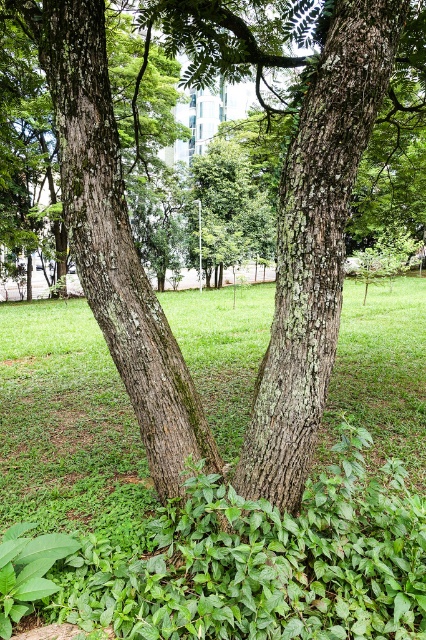
Between green leafy grass at center and smooth bark tree trunk at center, which one is positioned higher?

smooth bark tree trunk at center is higher up.

Is point (348, 616) positioned in front of point (299, 292)?

Yes.

Where is `green leafy grass at center`? Image resolution: width=426 pixels, height=640 pixels. green leafy grass at center is located at coordinates (262, 563).

Does green leafy grass at center have a lesser height compared to green rough bark tree trunk at left?

Indeed, green leafy grass at center has a lesser height compared to green rough bark tree trunk at left.

The image size is (426, 640). Find the location of `green leafy grass at center`. green leafy grass at center is located at coordinates (262, 563).

Between point (51, 362) and point (195, 451), which one is positioned in front?

Point (195, 451)

This screenshot has width=426, height=640. In order to click on green leafy grass at center in this screenshot , I will do `click(262, 563)`.

Between smooth bark tree trunk at center and green rough bark tree trunk at left, which one is positioned higher?

green rough bark tree trunk at left is higher up.

Does smooth bark tree trunk at center appear under green rough bark tree trunk at left?

Yes.

Who is more forward, (310, 237) or (178, 410)?

Positioned in front is point (310, 237).

This screenshot has width=426, height=640. Identify the location of smooth bark tree trunk at center. (314, 246).